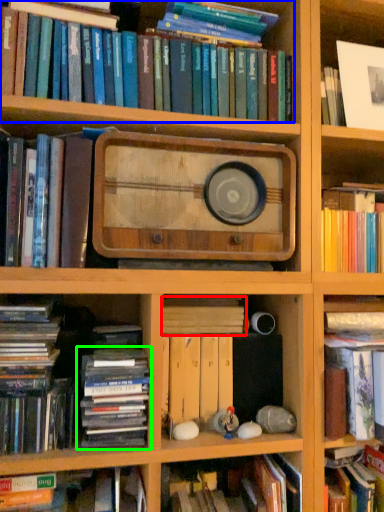
Question: Estimate the real-world distances between objects in this image. Which object is farther from book (highlighted by a red box), book (highlighted by a blue box) or book (highlighted by a green box)?

Choices:
 (A) book
 (B) book

Answer: (A)